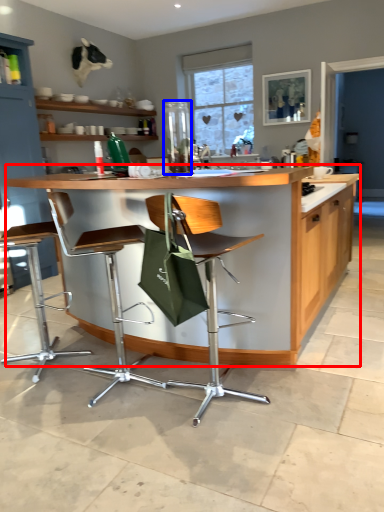
Question: Which object is closer to the camera taking this photo, countertop (highlighted by a red box) or appliance (highlighted by a blue box)?

Choices:
 (A) countertop
 (B) appliance

Answer: (A)